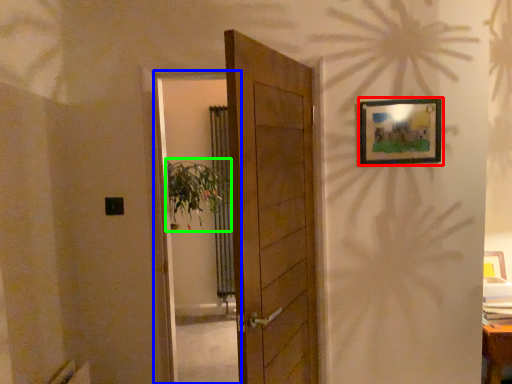
Question: Considering the real-world distances, which object is closest to picture frame (highlighted by a red box)? screen door (highlighted by a blue box) or plant (highlighted by a green box).

Choices:
 (A) screen door
 (B) plant

Answer: (B)